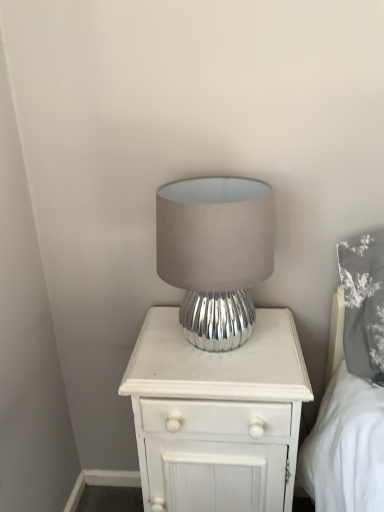
Question: From the image's perspective, would you say white wood nightstand at center is shown under silver metallic lamp at center?

Choices:
 (A) yes
 (B) no

Answer: (A)

Question: Is white wood nightstand at center in contact with silver metallic lamp at center?

Choices:
 (A) no
 (B) yes

Answer: (A)

Question: Does white wood nightstand at center turn towards silver metallic lamp at center?

Choices:
 (A) yes
 (B) no

Answer: (B)

Question: Considering the relative positions of white wood nightstand at center and silver metallic lamp at center in the image provided, is white wood nightstand at center to the right of silver metallic lamp at center from the viewer's perspective?

Choices:
 (A) no
 (B) yes

Answer: (B)

Question: Is white wood nightstand at center taller than silver metallic lamp at center?

Choices:
 (A) no
 (B) yes

Answer: (B)

Question: Considering the relative sizes of white wood nightstand at center and silver metallic lamp at center in the image provided, is white wood nightstand at center wider than silver metallic lamp at center?

Choices:
 (A) no
 (B) yes

Answer: (B)

Question: From a real-world perspective, is silver metallic lamp at center positioned over white wood nightstand at center based on gravity?

Choices:
 (A) no
 (B) yes

Answer: (B)

Question: Is silver metallic lamp at center bigger than white wood nightstand at center?

Choices:
 (A) yes
 (B) no

Answer: (B)

Question: Considering the relative sizes of silver metallic lamp at center and white wood nightstand at center in the image provided, is silver metallic lamp at center thinner than white wood nightstand at center?

Choices:
 (A) no
 (B) yes

Answer: (B)

Question: Does silver metallic lamp at center appear on the right side of white wood nightstand at center?

Choices:
 (A) no
 (B) yes

Answer: (A)

Question: Is silver metallic lamp at center smaller than white wood nightstand at center?

Choices:
 (A) yes
 (B) no

Answer: (A)

Question: Would you say silver metallic lamp at center contains white wood nightstand at center?

Choices:
 (A) yes
 (B) no

Answer: (B)

Question: Would you say silver metallic lamp at center is inside or outside white wood nightstand at center?

Choices:
 (A) inside
 (B) outside

Answer: (B)